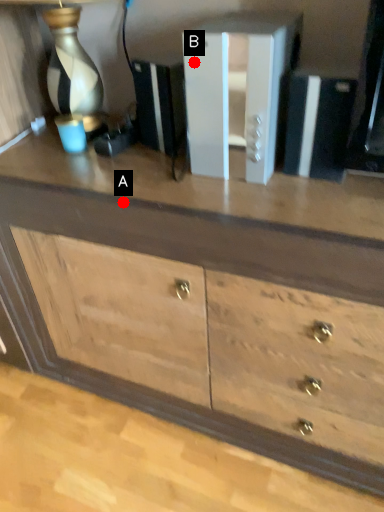
Question: Two points are circled on the image, labeled by A and B beside each circle. Among these points, which one is nearest to the camera?

Choices:
 (A) A is closer
 (B) B is closer

Answer: (B)